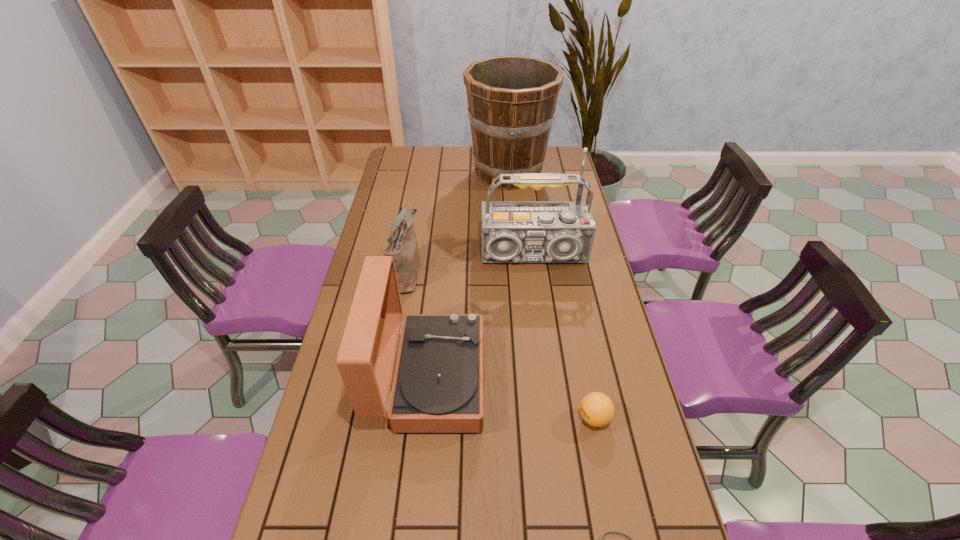
Locate an element on the screen. The height and width of the screenshot is (540, 960). bucket is located at coordinates (511, 99).

The width and height of the screenshot is (960, 540). What are the coordinates of `the tallest object` in the screenshot? It's located at (511, 99).

At what (x,y) coordinates should I click in order to perform the action: click on the fifth shortest object. Please return your answer as a coordinate pair (x, y). Looking at the image, I should click on (512, 231).

I want to click on phonograph record, so click(x=438, y=386).

Image resolution: width=960 pixels, height=540 pixels. I want to click on the third shortest object, so click(x=403, y=247).

The width and height of the screenshot is (960, 540). In order to click on ping-pong ball in this screenshot , I will do `click(597, 409)`.

In order to click on vacant space located 0.070m on the front of the tallest object in this screenshot , I will do `click(512, 206)`.

Identify the location of vacant position located on the front-facing side of the radio receiver. Image resolution: width=960 pixels, height=540 pixels. (544, 336).

This screenshot has height=540, width=960. Identify the location of blank space located 0.110m on the face of the phonograph record. (523, 379).

Image resolution: width=960 pixels, height=540 pixels. In order to click on blank space located on the front-facing side of the shoulder bag in this screenshot , I will do 480,271.